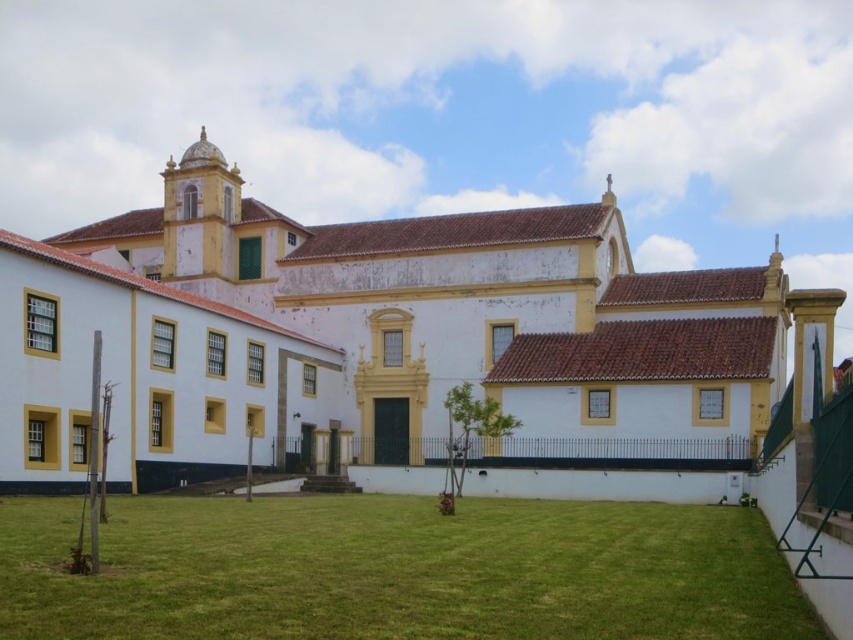
Question: Which object is farther from the camera taking this photo?

Choices:
 (A) green grass at lower center
 (B) white matte building at center

Answer: (B)

Question: Which point appears closest to the camera in this image?

Choices:
 (A) (311, 497)
 (B) (573, 284)

Answer: (A)

Question: In this image, where is white matte building at center located relative to green grass at lower center?

Choices:
 (A) above
 (B) below

Answer: (A)

Question: Is white matte building at center to the left of green grass at lower center from the viewer's perspective?

Choices:
 (A) yes
 (B) no

Answer: (B)

Question: Observing the image, what is the correct spatial positioning of white matte building at center in reference to green grass at lower center?

Choices:
 (A) above
 (B) below

Answer: (A)